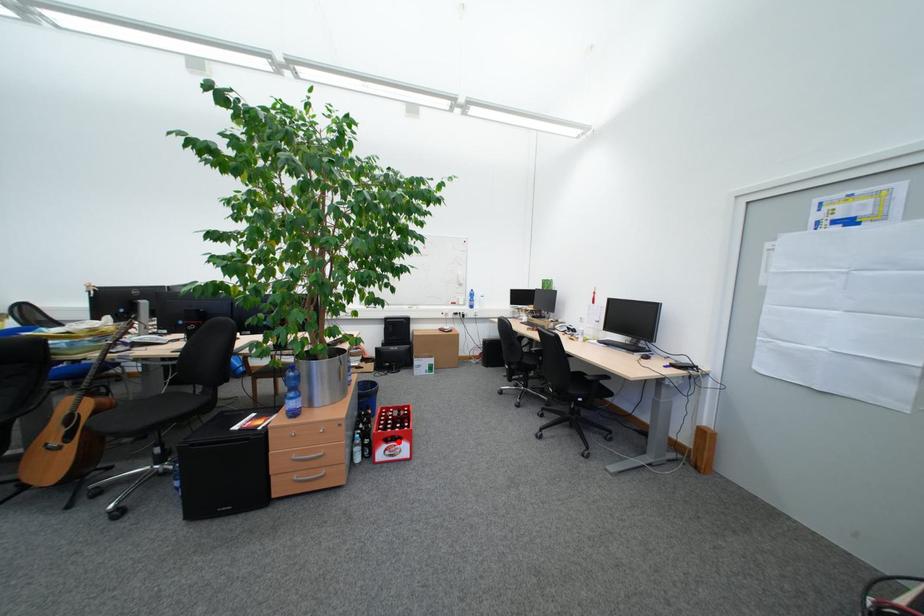
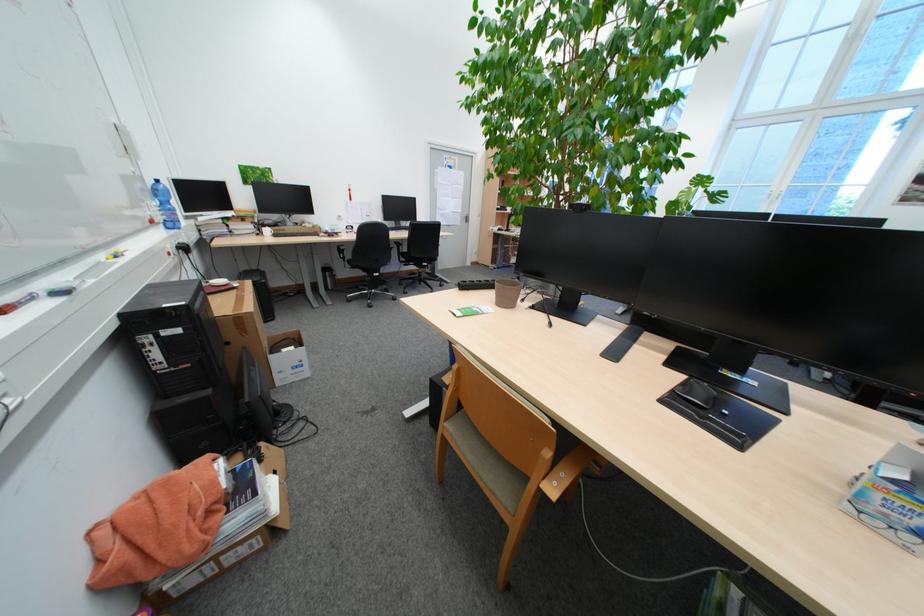
Question: I am providing you with two images of the same scene from different viewpoints. A red point is marked on the first image. Is the red point's position out of view in image 2?

Choices:
 (A) Yes
 (B) No

Answer: (A)